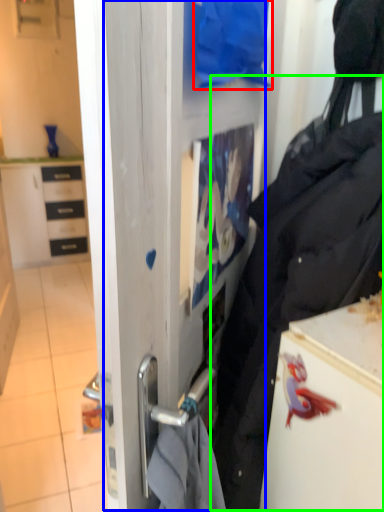
Question: Which object is the farthest from clothing (highlighted by a red box)? Choose among these: glass door (highlighted by a blue box) or tote bag (highlighted by a green box).

Choices:
 (A) glass door
 (B) tote bag

Answer: (B)